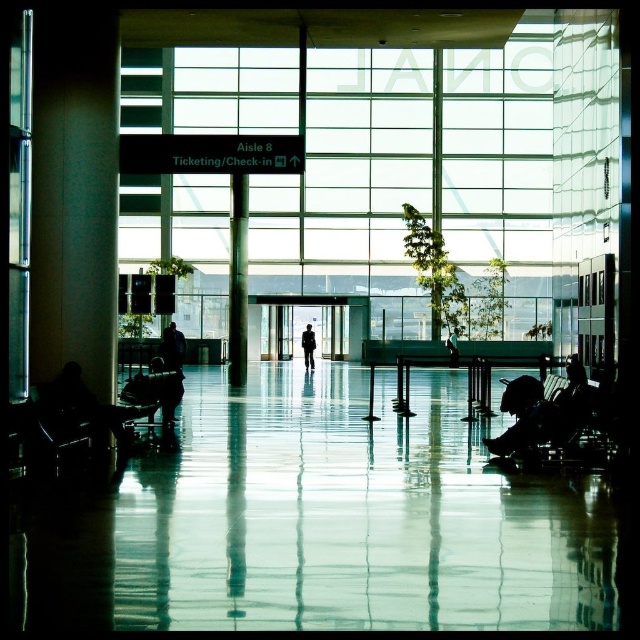
Consider the image. You are a traveler standing at the entrance of the airport terminal. You see a point marked at coordinates (237, 280). What object is located at that point?

The point at coordinates (237, 280) corresponds to the metallic column at center.

You are a traveler standing at the entrance of the airport terminal. You see a dark blue jacket at center and a black suit at center. Which clothing item is shorter in height?

The dark blue jacket at center is not as tall as the black suit at center, so the dark blue jacket at center is shorter.

You are an airport security robot that needs to locate a lost item. You see a silhouette figure at left and a light brown leather jacket at center. Which object is taller?

The silhouette figure at left is taller than the light brown leather jacket at center.